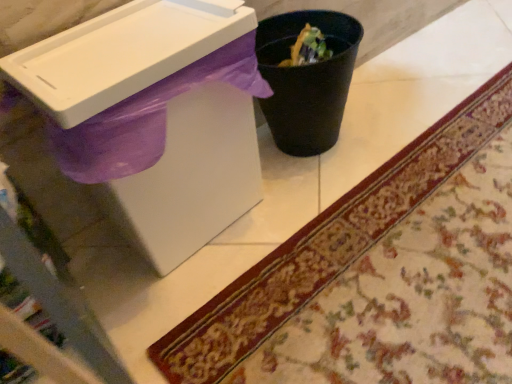
Locate an element on the screen. empty space that is ontop of carpeted mat at lower right (from a real-world perspective) is located at coordinates (410, 242).